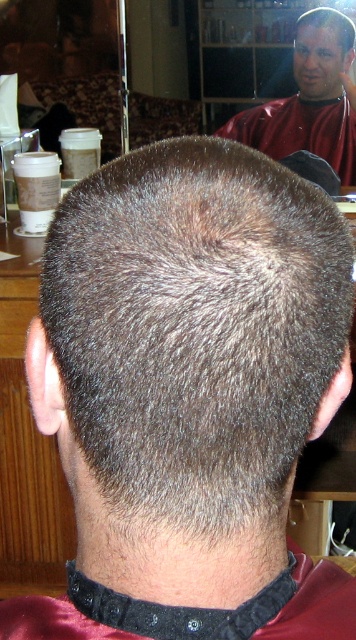
You are a customer in a barbershop and you want to know where the barber is located relative to your head. The customer has dark brown hair at center and the barber is wearing a smooth red barber at upper right. Can you tell me where the barber is in relation to your head?

The smooth red barber at upper right is above the dark brown hair at center, so the barber is positioned above your head.

You are standing in a barbershop and see two points marked in the image. The first point is at coordinates point [50,298] and the second point is at point [321,13]. Which point is nearer to you?

Point [50,298] is closer to the viewer than point [321,13].

You are a customer in a barbershop looking at the mirror reflection. You see two people with dark brown hair at center and dark gray hair at center. Which person is closer to you based on their position in the mirror?

The dark brown hair at center is in front of dark gray hair at center, so the person with dark brown hair at center is closer to you.